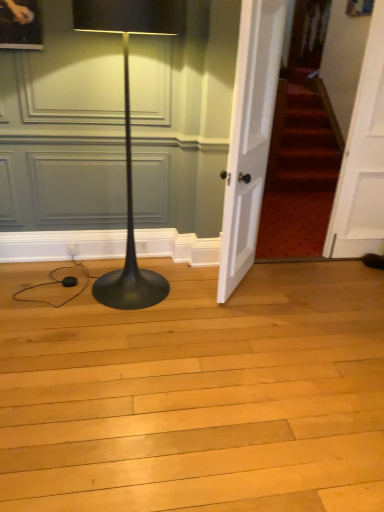
Question: From a real-world perspective, is black glossy floor lamp at left positioned over white wooden door at right, the second door viewed from the left, based on gravity?

Choices:
 (A) yes
 (B) no

Answer: (B)

Question: Can you confirm if black glossy floor lamp at left is positioned to the right of white wooden door at right, the second door viewed from the left?

Choices:
 (A) yes
 (B) no

Answer: (B)

Question: Considering the relative sizes of black glossy floor lamp at left and white wooden door at right, the second door viewed from the left, in the image provided, is black glossy floor lamp at left thinner than white wooden door at right, the second door viewed from the left,?

Choices:
 (A) yes
 (B) no

Answer: (B)

Question: From the image's perspective, is black glossy floor lamp at left over white wooden door at right, the second door viewed from the left?

Choices:
 (A) no
 (B) yes

Answer: (A)

Question: Does black glossy floor lamp at left turn towards white wooden door at right, the 1th door in the right-to-left sequence?

Choices:
 (A) no
 (B) yes

Answer: (A)

Question: From a real-world perspective, is black glossy floor lamp at left positioned above or below white wooden door at center, the second door when ordered from right to left?

Choices:
 (A) below
 (B) above

Answer: (A)

Question: In the image, is black glossy floor lamp at left positioned in front of or behind white wooden door at center, the second door when ordered from right to left?

Choices:
 (A) front
 (B) behind

Answer: (A)

Question: From the image's perspective, is black glossy floor lamp at left above or below white wooden door at center, the first door in the left-to-right sequence?

Choices:
 (A) below
 (B) above

Answer: (A)

Question: Considering the positions of black glossy floor lamp at left and white wooden door at center, the second door when ordered from right to left, in the image, is black glossy floor lamp at left taller or shorter than white wooden door at center, the second door when ordered from right to left,?

Choices:
 (A) short
 (B) tall

Answer: (A)

Question: Based on their positions, is white wooden door at center, the first door in the left-to-right sequence, located to the left or right of white wooden door at right, the 1th door in the right-to-left sequence?

Choices:
 (A) left
 (B) right

Answer: (A)

Question: Is white wooden door at center, the second door when ordered from right to left, inside or outside of white wooden door at right, the 1th door in the right-to-left sequence?

Choices:
 (A) outside
 (B) inside

Answer: (A)

Question: In the image, is white wooden door at center, the second door when ordered from right to left, positioned in front of or behind white wooden door at right, the 1th door in the right-to-left sequence?

Choices:
 (A) behind
 (B) front

Answer: (B)

Question: Considering the positions of white wooden door at center, the second door when ordered from right to left, and white wooden door at right, the 1th door in the right-to-left sequence, in the image, is white wooden door at center, the second door when ordered from right to left, bigger or smaller than white wooden door at right, the 1th door in the right-to-left sequence,?

Choices:
 (A) small
 (B) big

Answer: (B)

Question: In terms of width, does white wooden door at center, the second door when ordered from right to left, look wider or thinner when compared to black glossy floor lamp at left?

Choices:
 (A) thin
 (B) wide

Answer: (A)

Question: From the image's perspective, is white wooden door at center, the second door when ordered from right to left, located above or below black glossy floor lamp at left?

Choices:
 (A) below
 (B) above

Answer: (B)